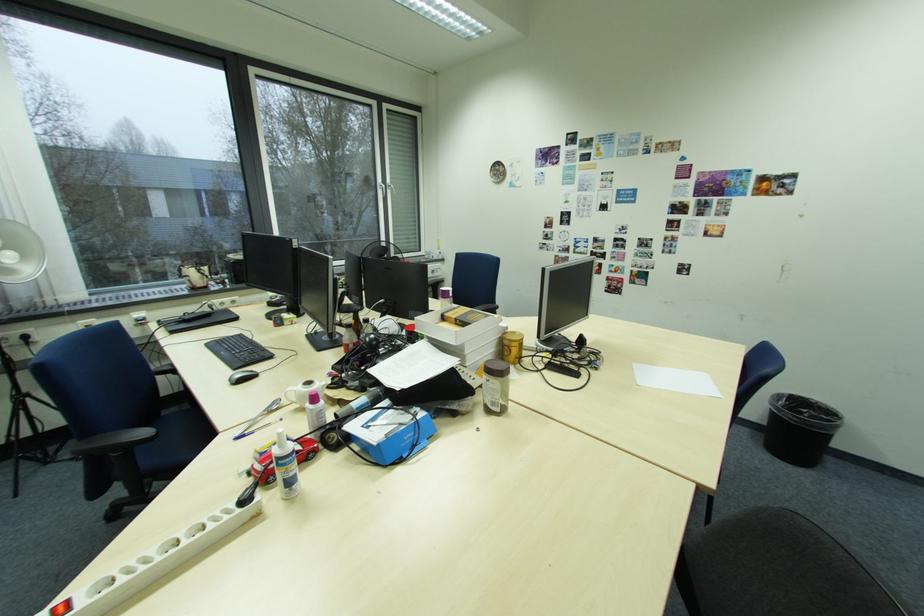
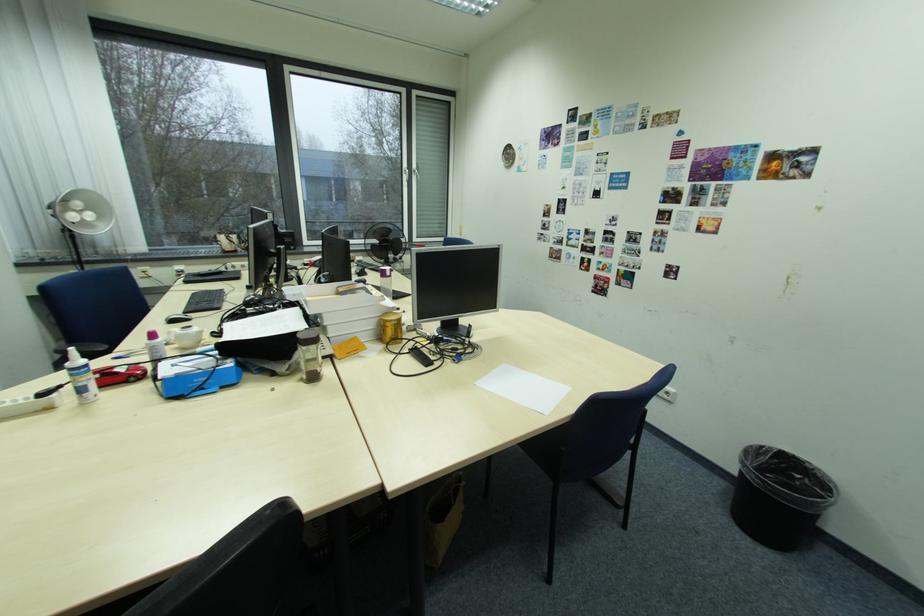
Locate, in the second image, the point that corresponds to pixel 811 411 in the first image.

(807, 477)